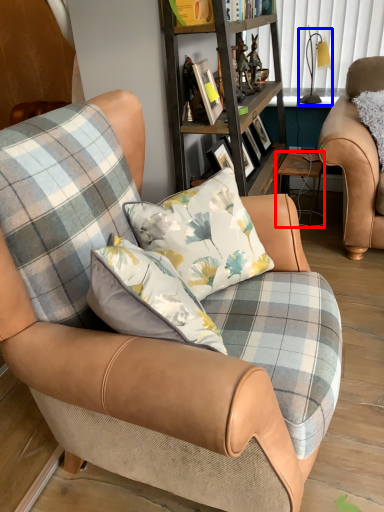
Question: Which of the following is the closest to the observer, table (highlighted by a red box) or lamp (highlighted by a blue box)?

Choices:
 (A) table
 (B) lamp

Answer: (A)